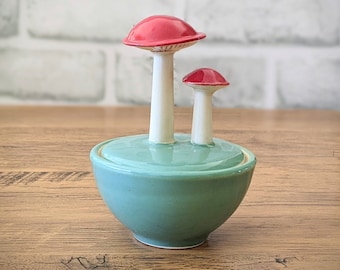
Locate an element on the screen. The image size is (340, 270). teal colored bowl is located at coordinates (168, 207).